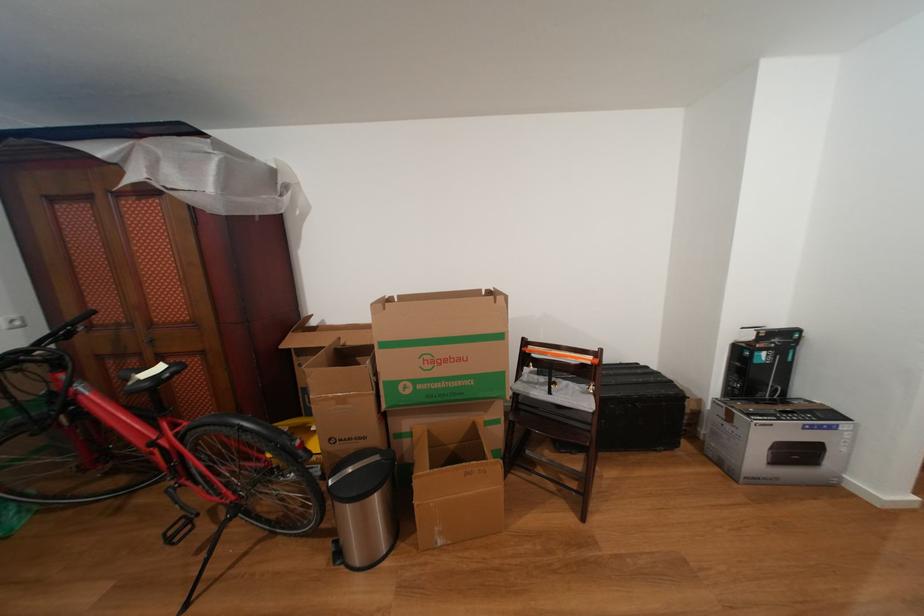
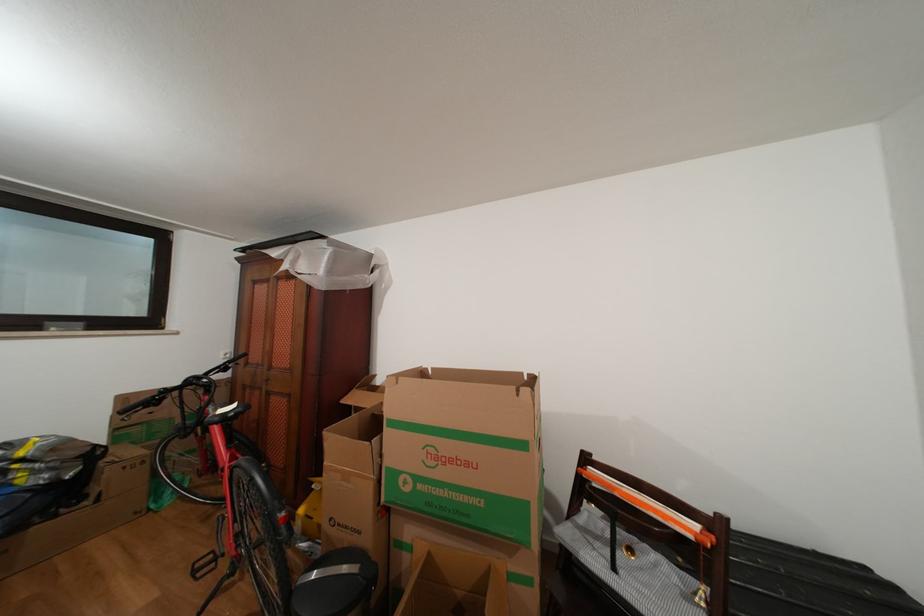
Question: The camera is either moving clockwise (left) or counter-clockwise (right) around the object. The first image is from the beginning of the video and the second image is from the end. Is the camera moving left or right when shooting the video?

Choices:
 (A) Left
 (B) Right

Answer: (B)